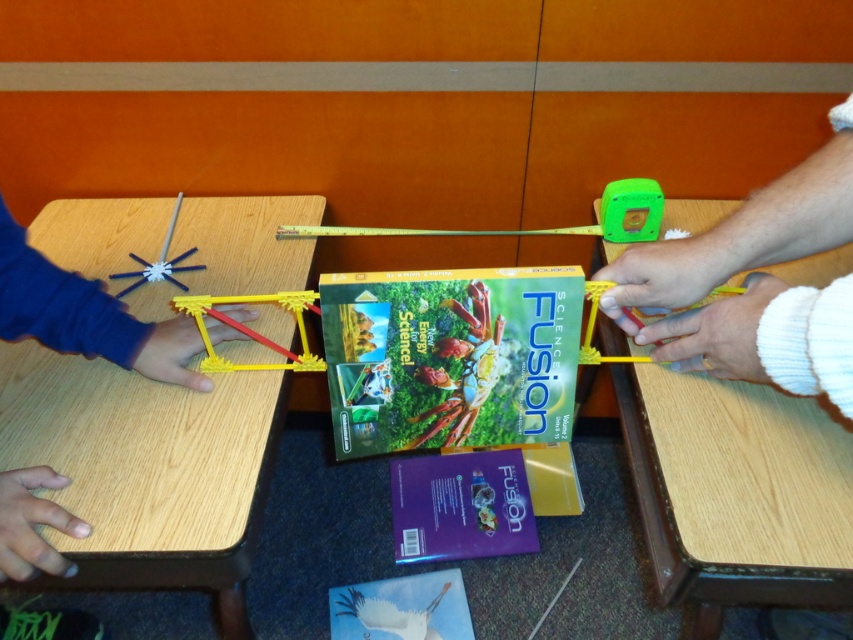
Question: Can you confirm if green matte toy at upper right is positioned to the right of metallic silver starburst at left?

Choices:
 (A) no
 (B) yes

Answer: (B)

Question: Which object is positioned closest to the wooden table at left?

Choices:
 (A) metallic ruler at center
 (B) yellow plastic frame at center
 (C) white fuzzy sweater at right

Answer: (B)

Question: Can you confirm if white fuzzy sweater at right is positioned below white matte bird at center?

Choices:
 (A) yes
 (B) no

Answer: (B)

Question: Which point is closer to the camera?

Choices:
 (A) (204, 333)
 (B) (366, 614)
 (C) (184, 257)
 (D) (659, 324)

Answer: (D)

Question: Is yellow plastic frame at center closer to camera compared to metallic ruler at center?

Choices:
 (A) yes
 (B) no

Answer: (A)

Question: Estimate the real-world distances between objects in this image. Which object is closer to the yellow plastic frame at center?

Choices:
 (A) white fuzzy sweater at right
 (B) wooden table at left

Answer: (B)